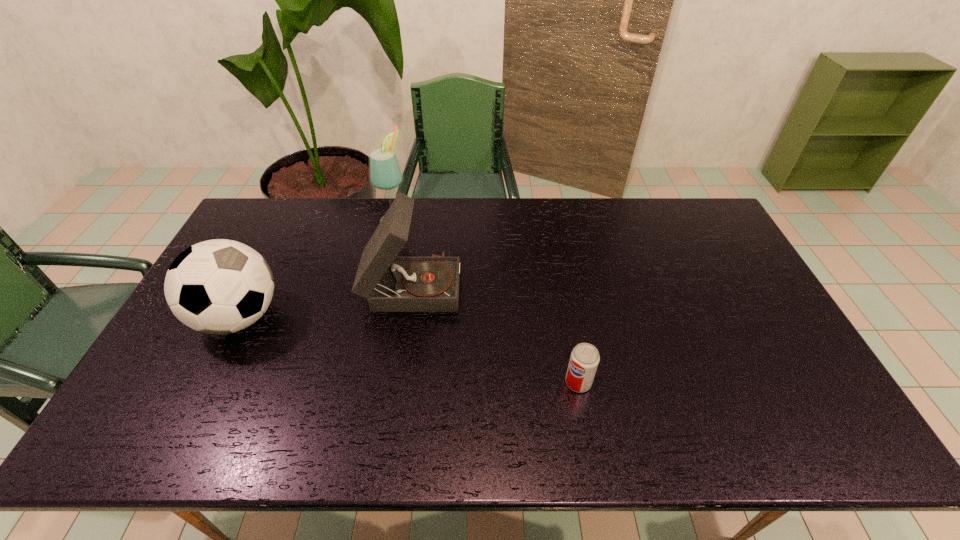
Find the location of a particular element. the tallest object is located at coordinates (385, 173).

At what (x,y) coordinates should I click in order to perform the action: click on the farthest object. Please return your answer as a coordinate pair (x, y). Looking at the image, I should click on (385, 173).

The height and width of the screenshot is (540, 960). Find the location of `phonograph_record`. phonograph_record is located at coordinates (390, 284).

This screenshot has height=540, width=960. Identify the location of soccer ball. (221, 286).

In order to click on the third tallest object in this screenshot , I will do `click(221, 286)`.

This screenshot has height=540, width=960. I want to click on soda, so click(584, 359).

This screenshot has width=960, height=540. What are the coordinates of `the nearest object` in the screenshot? It's located at (584, 359).

Find the location of a particular element. free space located 0.220m on the right of the alcohol is located at coordinates (472, 219).

Where is `vacant space located on the front-facing side of the phonograph_record`? The height and width of the screenshot is (540, 960). vacant space located on the front-facing side of the phonograph_record is located at coordinates (553, 284).

The width and height of the screenshot is (960, 540). I want to click on free location located on the main logo of the second shortest object, so click(346, 317).